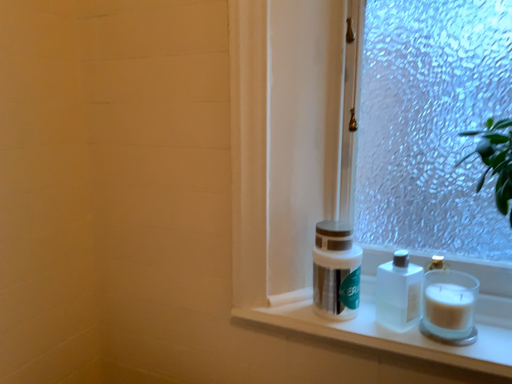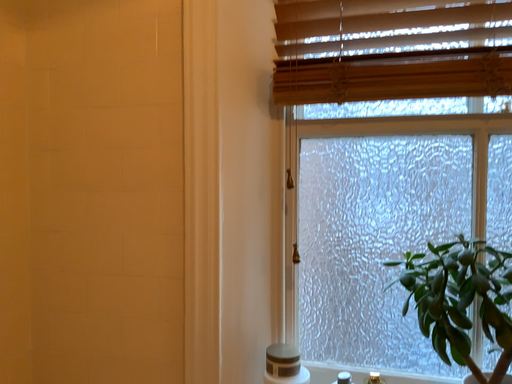
Question: How did the camera likely rotate when shooting the video?

Choices:
 (A) rotated left
 (B) rotated right

Answer: (B)